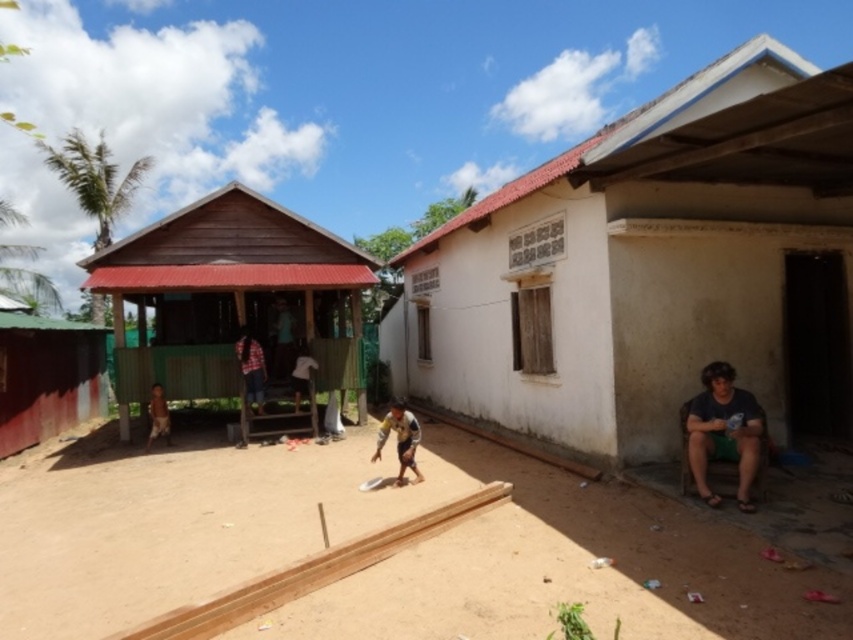
Question: Which of the following is the farthest from the observer?

Choices:
 (A) (233, 189)
 (B) (38, 355)
 (C) (125, 564)
 (D) (712, 440)

Answer: (B)

Question: Is plaid shirt at center wider than brown furry dog at lower left?

Choices:
 (A) yes
 (B) no

Answer: (A)

Question: Can you confirm if rusty corrugated metal hut at left is bigger than brown furry dog at lower left?

Choices:
 (A) yes
 (B) no

Answer: (A)

Question: Which point appears closest to the camera in this image?

Choices:
 (A) (399, 481)
 (B) (700, 451)

Answer: (B)

Question: Does white stucco house at right appear on the left side of dark blue fabric at lower right?

Choices:
 (A) no
 (B) yes

Answer: (A)

Question: Which of the following is the farthest from the observer?

Choices:
 (A) brown sandy dirt field at center
 (B) brown fabric shirt at center

Answer: (B)